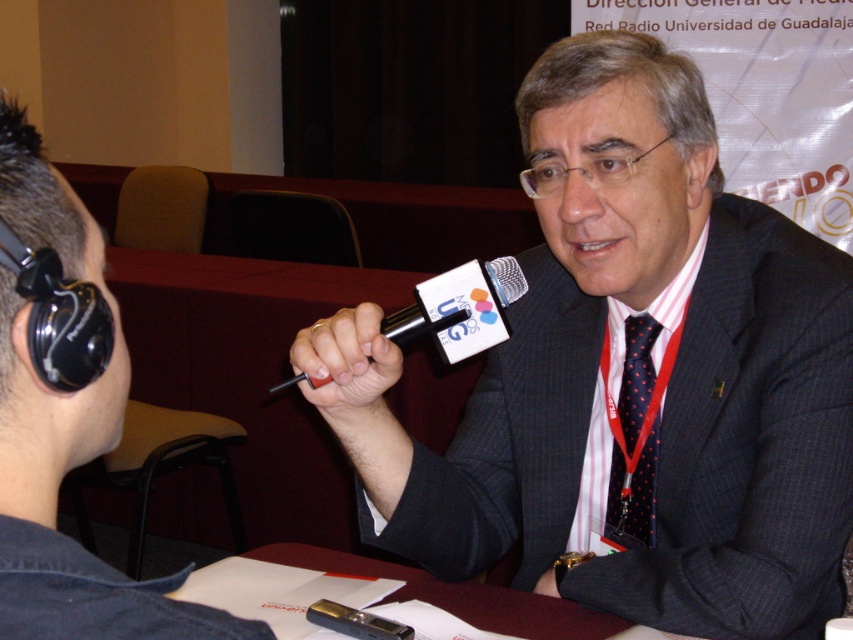
Question: Among these objects, which one is nearest to the camera?

Choices:
 (A) black textured suit at center
 (B) black rubber microphone at center
 (C) black plastic microphone at center
 (D) dark blue dotted tie at center

Answer: (C)

Question: Can you confirm if matte black microphone at center is positioned above black plastic microphone at center?

Choices:
 (A) yes
 (B) no

Answer: (B)

Question: Based on their relative distances, which object is nearer to the black textured suit at center?

Choices:
 (A) dark blue dotted tie at center
 (B) matte black microphone at center

Answer: (A)

Question: Considering the real-world distances, which object is farthest from the black rubber microphone at center?

Choices:
 (A) black plastic microphone at center
 (B) black textured suit at center
 (C) dark blue dotted tie at center

Answer: (C)

Question: Observing the image, what is the correct spatial positioning of matte black microphone at center in reference to black rubber microphone at center?

Choices:
 (A) left
 (B) right

Answer: (A)

Question: Can you confirm if matte black microphone at center is positioned above black plastic microphone at center?

Choices:
 (A) yes
 (B) no

Answer: (B)